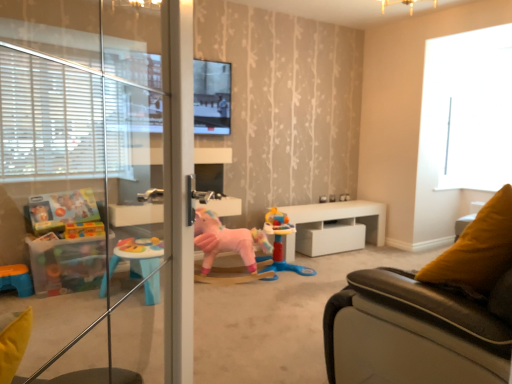
Question: Is rubberized plastic playset at center, the first toy in the right-to-left sequence, facing towards white glossy table at center?

Choices:
 (A) no
 (B) yes

Answer: (A)

Question: Is rubberized plastic playset at center, the second toy when ordered from left to right, located outside white glossy table at center?

Choices:
 (A) no
 (B) yes

Answer: (B)

Question: Can you confirm if rubberized plastic playset at center, the first toy in the right-to-left sequence, is bigger than white glossy table at center?

Choices:
 (A) no
 (B) yes

Answer: (A)

Question: Considering the relative sizes of rubberized plastic playset at center, the first toy in the right-to-left sequence, and white glossy table at center in the image provided, is rubberized plastic playset at center, the first toy in the right-to-left sequence, thinner than white glossy table at center?

Choices:
 (A) yes
 (B) no

Answer: (B)

Question: Looking at the image, does transparent glass window at upper right seem bigger or smaller compared to matte black tv at upper center?

Choices:
 (A) big
 (B) small

Answer: (A)

Question: In terms of height, does transparent glass window at upper right look taller or shorter compared to matte black tv at upper center?

Choices:
 (A) tall
 (B) short

Answer: (A)

Question: Is point (480, 107) positioned closer to the camera than point (210, 61)?

Choices:
 (A) farther
 (B) closer

Answer: (A)

Question: Visually, is transparent glass window at upper right positioned to the left or to the right of matte black tv at upper center?

Choices:
 (A) left
 (B) right

Answer: (B)

Question: Which is correct: white glossy table at center is inside rubberized plastic playset at center, the first toy in the right-to-left sequence, or outside of it?

Choices:
 (A) inside
 (B) outside

Answer: (B)

Question: From the image's perspective, is white glossy table at center above or below rubberized plastic playset at center, the first toy in the right-to-left sequence?

Choices:
 (A) above
 (B) below

Answer: (A)

Question: From a real-world perspective, relative to rubberized plastic playset at center, the first toy in the right-to-left sequence, is white glossy table at center vertically above or below?

Choices:
 (A) above
 (B) below

Answer: (B)

Question: Is white glossy table at center in front of or behind rubberized plastic playset at center, the second toy when ordered from left to right, in the image?

Choices:
 (A) front
 (B) behind

Answer: (B)

Question: Considering the positions of transparent glass window at upper right and white glossy table at center in the image, is transparent glass window at upper right bigger or smaller than white glossy table at center?

Choices:
 (A) small
 (B) big

Answer: (A)

Question: Considering their positions, is transparent glass window at upper right located in front of or behind white glossy table at center?

Choices:
 (A) front
 (B) behind

Answer: (B)